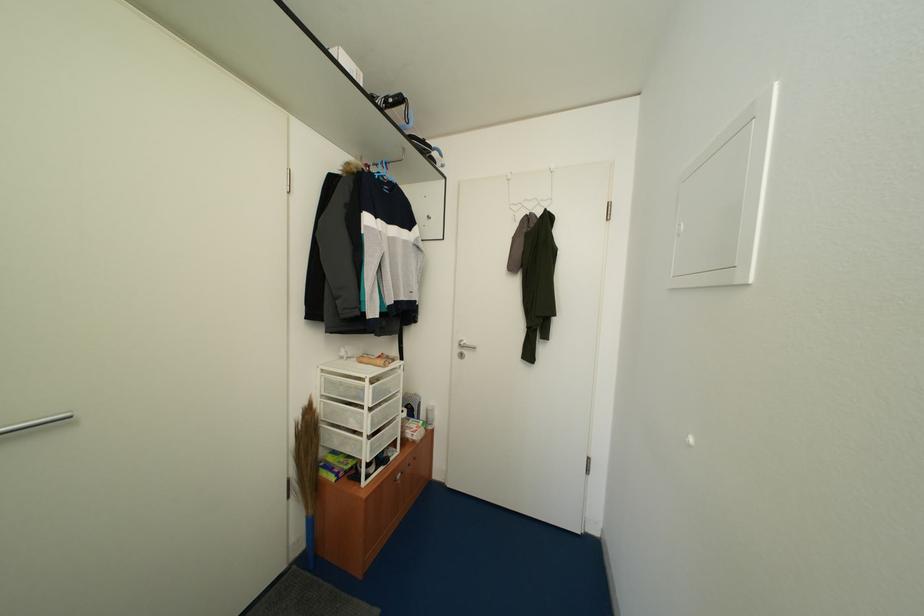
Locate an element on the screen. white drawer handle is located at coordinates (398, 476).